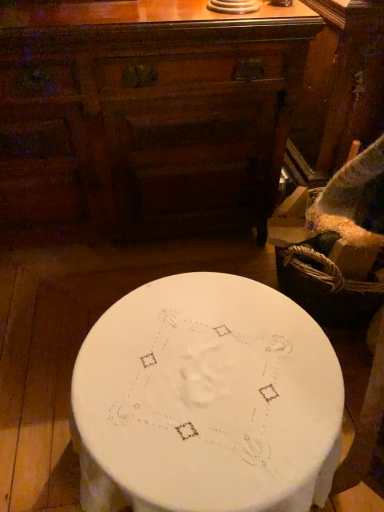
Locate an element on the screen. matte brown chest of drawers at center is located at coordinates (144, 116).

What do you see at coordinates (144, 116) in the screenshot? I see `matte brown chest of drawers at center` at bounding box center [144, 116].

Find the location of a particular element. white fabric-covered table at center is located at coordinates (206, 401).

The image size is (384, 512). What do you see at coordinates (206, 401) in the screenshot?
I see `white fabric-covered table at center` at bounding box center [206, 401].

From the picture: Measure the distance between white fabric-covered table at center and camera.

The distance of white fabric-covered table at center from camera is 29.69 inches.

This screenshot has width=384, height=512. I want to click on matte brown chest of drawers at center, so click(x=144, y=116).

Considering the positions of objects matte brown chest of drawers at center and white fabric-covered table at center in the image provided, who is more to the right, matte brown chest of drawers at center or white fabric-covered table at center?

white fabric-covered table at center.

Is matte brown chest of drawers at center in front of white fabric-covered table at center?

No.

Does point (1, 138) come in front of point (239, 455)?

No, it is behind (239, 455).

From the image's perspective, between matte brown chest of drawers at center and white fabric-covered table at center, which one is located above?

From the image's view, matte brown chest of drawers at center is above.

From a real-world perspective, is matte brown chest of drawers at center positioned under white fabric-covered table at center based on gravity?

No, from a real-world perspective, matte brown chest of drawers at center is not beneath white fabric-covered table at center.

Looking at this image, looking at their sizes, would you say matte brown chest of drawers at center is wider or thinner than white fabric-covered table at center?

Considering their sizes, matte brown chest of drawers at center looks slimmer than white fabric-covered table at center.

Can you confirm if matte brown chest of drawers at center is shorter than white fabric-covered table at center?

No, matte brown chest of drawers at center is not shorter than white fabric-covered table at center.

Which of these two, matte brown chest of drawers at center or white fabric-covered table at center, is smaller?

white fabric-covered table at center is smaller.

Is white fabric-covered table at center surrounded by matte brown chest of drawers at center?

No, white fabric-covered table at center is not surrounded by matte brown chest of drawers at center.

Consider the image. Is matte brown chest of drawers at center positioned far away from white fabric-covered table at center?

Actually, matte brown chest of drawers at center and white fabric-covered table at center are a little close together.

Is matte brown chest of drawers at center looking in the opposite direction of white fabric-covered table at center?

No, matte brown chest of drawers at center is not facing the opposite direction of white fabric-covered table at center.

Measure the distance from matte brown chest of drawers at center to white fabric-covered table at center.

matte brown chest of drawers at center is 29.13 inches from white fabric-covered table at center.

The height and width of the screenshot is (512, 384). I want to click on table on the right of matte brown chest of drawers at center, so click(206, 401).

Considering the positions of objects white fabric-covered table at center and matte brown chest of drawers at center in the image provided, who is more to the right, white fabric-covered table at center or matte brown chest of drawers at center?

Positioned to the right is white fabric-covered table at center.

Considering the positions of objects white fabric-covered table at center and matte brown chest of drawers at center in the image provided, who is behind, white fabric-covered table at center or matte brown chest of drawers at center?

matte brown chest of drawers at center is more distant.

Does point (212, 395) come behind point (106, 89)?

No.

From the image's perspective, which is below, white fabric-covered table at center or matte brown chest of drawers at center?

From the image's view, white fabric-covered table at center is below.

From a real-world perspective, is white fabric-covered table at center positioned above or below matte brown chest of drawers at center?

In terms of real-world spatial position, white fabric-covered table at center is below matte brown chest of drawers at center.

Is white fabric-covered table at center thinner than matte brown chest of drawers at center?

No, white fabric-covered table at center is not thinner than matte brown chest of drawers at center.

Considering the sizes of white fabric-covered table at center and matte brown chest of drawers at center in the image, is white fabric-covered table at center taller or shorter than matte brown chest of drawers at center?

Clearly, white fabric-covered table at center is shorter compared to matte brown chest of drawers at center.

Considering the relative sizes of white fabric-covered table at center and matte brown chest of drawers at center in the image provided, is white fabric-covered table at center bigger than matte brown chest of drawers at center?

No, white fabric-covered table at center is not bigger than matte brown chest of drawers at center.

Is white fabric-covered table at center positioned beyond the bounds of matte brown chest of drawers at center?

Yes, white fabric-covered table at center is not within matte brown chest of drawers at center.

Would you say white fabric-covered table at center is a long distance from matte brown chest of drawers at center?

Actually, white fabric-covered table at center and matte brown chest of drawers at center are a little close together.

Is white fabric-covered table at center turned away from matte brown chest of drawers at center?

white fabric-covered table at center does not have its back to matte brown chest of drawers at center.

In the scene shown: What's the angular difference between white fabric-covered table at center and matte brown chest of drawers at center's facing directions?

88.5 degrees.

Find the location of a particular element. This screenshot has width=384, height=512. table that appears on the right of matte brown chest of drawers at center is located at coordinates (206, 401).

Image resolution: width=384 pixels, height=512 pixels. Find the location of `chest of drawers on the left side of white fabric-covered table at center`. chest of drawers on the left side of white fabric-covered table at center is located at coordinates (144, 116).

Locate an element on the screen. the chest of drawers located above the white fabric-covered table at center (from the image's perspective) is located at coordinates 144,116.